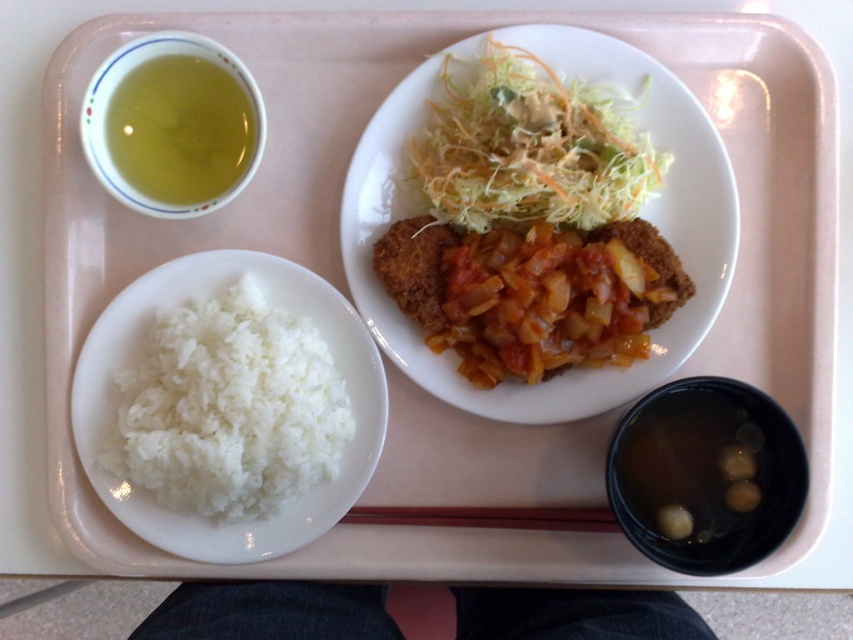
Does point (651, 108) come closer to viewer compared to point (485, 525)?

Yes, point (651, 108) is in front of point (485, 525).

Which is in front, point (416, 93) or point (560, 513)?

Point (416, 93) is in front.

Is point (454, 401) farther from camera compared to point (442, 509)?

No, it is not.

This screenshot has height=640, width=853. What are the coordinates of `golden brown fried chicken at center` in the screenshot? It's located at (639, 212).

Does point (334, 422) lie in front of point (567, 518)?

Yes, it is in front of point (567, 518).

Is white matte rice at lower left below brown wood chopsticks at center?

Actually, white matte rice at lower left is above brown wood chopsticks at center.

Who is more forward, (x=151, y=374) or (x=392, y=515)?

Point (x=151, y=374) is in front.

Find the location of `white matte rice at lower left`. white matte rice at lower left is located at coordinates (229, 408).

Is point (732, 189) closer to camera compared to point (447, 157)?

Yes.

Which of these two, golden brown fried chicken at center or shredded green salad at upper center, stands taller?

golden brown fried chicken at center is taller.

Which is behind, point (376, 301) or point (480, 150)?

The point (376, 301) is more distant.

You are a GUI agent. You are given a task and a screenshot of the screen. Output one action in this format:
    pyautogui.click(x=<x>, y=<y>)
    Task: Click on the golden brown fried chicken at center
    The image size is (853, 640).
    Given the screenshot: What is the action you would take?
    pyautogui.click(x=639, y=212)